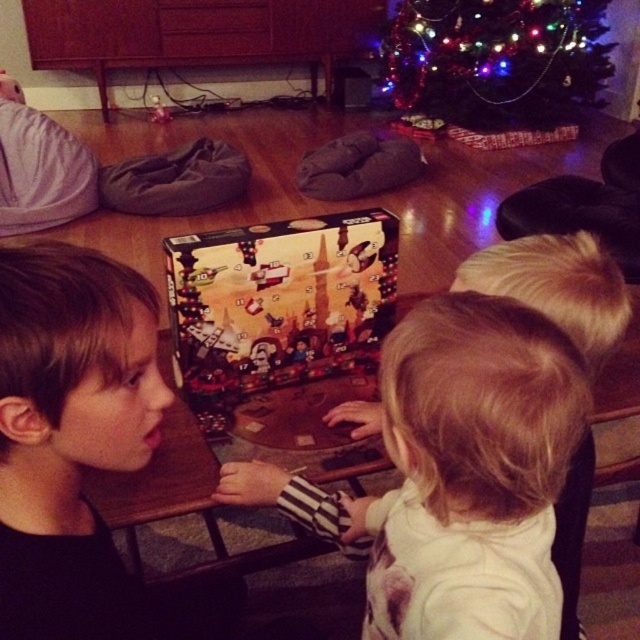
Based on the photo, can you confirm if brown matte hair at center is taller than decorated plastic christmas tree at upper center?

Incorrect, brown matte hair at center's height is not larger of decorated plastic christmas tree at upper center's.

Is point (26, 294) positioned before point (492, 61)?

Yes.

Identify the location of brown matte hair at center. The width and height of the screenshot is (640, 640). (70, 436).

Between brown matte hair at center and printed cardboard advent calendar at center, which one is positioned lower?

brown matte hair at center is lower down.

Find the location of a particular element. The image size is (640, 640). brown matte hair at center is located at coordinates (70, 436).

Can you confirm if brown matte hair at center is thinner than white soft shirt at center?

Correct, brown matte hair at center's width is less than white soft shirt at center's.

Between brown matte hair at center and white soft shirt at center, which one appears on the right side from the viewer's perspective?

white soft shirt at center is more to the right.

I want to click on brown matte hair at center, so click(x=70, y=436).